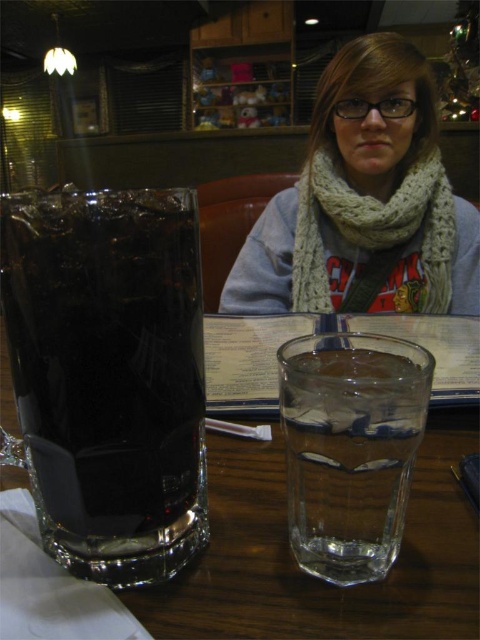
Between point (356, 236) and point (307, 502), which one is positioned behind?

Positioned behind is point (356, 236).

Can you confirm if knitted scarf at upper center is positioned to the right of clear glass water at center?

Indeed, knitted scarf at upper center is positioned on the right side of clear glass water at center.

Identify the location of knitted scarf at upper center. (364, 202).

Is knitted scarf at upper center wider than white knitted scarf at upper center?

Indeed, knitted scarf at upper center has a greater width compared to white knitted scarf at upper center.

Who is positioned more to the right, knitted scarf at upper center or white knitted scarf at upper center?

knitted scarf at upper center

Measure the distance between point [342,195] and camera.

36.97 inches

The image size is (480, 640). What are the coordinates of `knitted scarf at upper center` in the screenshot? It's located at pyautogui.click(x=364, y=202).

Can you confirm if dark glass mug at left is shorter than clear glass water at center?

Incorrect, dark glass mug at left's height does not fall short of clear glass water at center's.

Between dark glass mug at left and clear glass water at center, which one has less height?

clear glass water at center

Who is more distant from viewer, [78,243] or [300,451]?

Point [300,451]

Where is `dark glass mug at left`? This screenshot has width=480, height=640. dark glass mug at left is located at coordinates (108, 376).